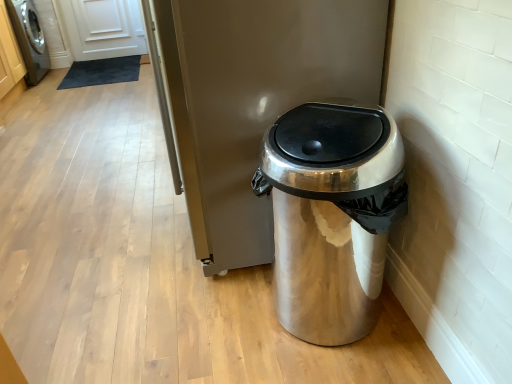
Identify the location of free space in front of satin silver trash can at center. Image resolution: width=512 pixels, height=384 pixels. (197, 330).